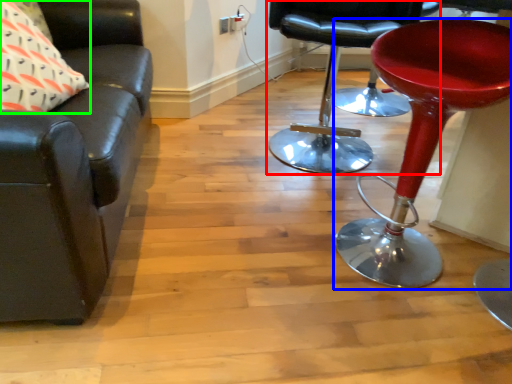
Question: Which object is positioned farthest from chair (highlighted by a red box)? Select from stool (highlighted by a blue box) and pillow (highlighted by a green box).

Choices:
 (A) stool
 (B) pillow

Answer: (B)